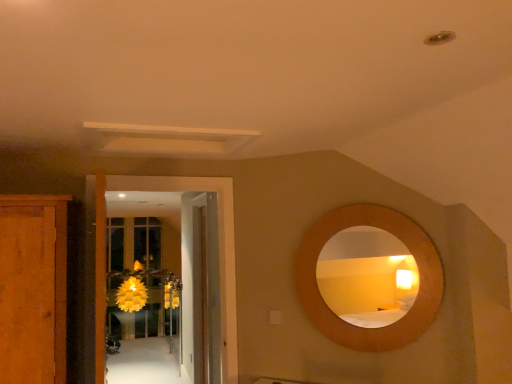
Measure the distance between wooden cabinet at left and camera.

The depth of wooden cabinet at left is 6.20 feet.

Image resolution: width=512 pixels, height=384 pixels. What do you see at coordinates (131, 295) in the screenshot?
I see `yellow paper flower at center` at bounding box center [131, 295].

Where is `translucent yellow glass door at center`? This screenshot has width=512, height=384. translucent yellow glass door at center is located at coordinates (133, 243).

The height and width of the screenshot is (384, 512). I want to click on wooden cabinet at left, so click(x=33, y=288).

Find the location of a particular element. The height and width of the screenshot is (384, 512). the 2nd door behind the wooden cabinet at left, counting from the anchor's position is located at coordinates (200, 287).

Which object is thinner, wooden door at center, arranged as the 2th door when viewed from the front, or wooden cabinet at left?

wooden door at center, arranged as the 2th door when viewed from the front.

From the image's perspective, is wooden door at center, the first door positioned from the back, below wooden cabinet at left?

Correct, wooden door at center, the first door positioned from the back, appears lower than wooden cabinet at left in the image.

From a real-world perspective, which is physically below, wooden cabinet at left or wooden circular mirror at upper right?

wooden cabinet at left.

Would you say wooden cabinet at left is a long distance from wooden circular mirror at upper right?

Yes, wooden cabinet at left is far from wooden circular mirror at upper right.

From the image's perspective, is wooden cabinet at left beneath wooden circular mirror at upper right?

Yes.

Consider the image. Which of these two, wooden cabinet at left or wooden circular mirror at upper right, is wider?

Wider between the two is wooden cabinet at left.

Is point (126, 308) positioned in front of point (222, 216)?

No, (126, 308) is behind (222, 216).

From the image's perspective, relative to white glossy door at center, the second door positioned from the back, is yellow paper flower at center above or below?

From the image's perspective, yellow paper flower at center appears below white glossy door at center, the second door positioned from the back.

Can you confirm if yellow paper flower at center is wider than white glossy door at center, the second door positioned from the back?

Yes, yellow paper flower at center is wider than white glossy door at center, the second door positioned from the back.

Are yellow paper flower at center and white glossy door at center, the second door positioned from the back, far apart?

That's right, there is a large distance between yellow paper flower at center and white glossy door at center, the second door positioned from the back.

From a real-world perspective, does wooden circular mirror at upper right sit lower than wooden door at center, arranged as the 2th door when viewed from the front?

Actually, wooden circular mirror at upper right is physically above wooden door at center, arranged as the 2th door when viewed from the front, in the real world.

Is wooden door at center, arranged as the 2th door when viewed from the front, inside wooden circular mirror at upper right?

No, wooden circular mirror at upper right does not contain wooden door at center, arranged as the 2th door when viewed from the front.

Is wooden circular mirror at upper right smaller than wooden door at center, arranged as the 2th door when viewed from the front?

Yes.

Considering the sizes of objects wooden door at center, the first door positioned from the back, and wooden circular mirror at upper right in the image provided, who is shorter, wooden door at center, the first door positioned from the back, or wooden circular mirror at upper right?

wooden circular mirror at upper right.

Is wooden door at center, the first door positioned from the back, aimed at wooden circular mirror at upper right?

No, wooden door at center, the first door positioned from the back, is not facing towards wooden circular mirror at upper right.

From the image's perspective, is wooden door at center, the first door positioned from the back, located above or below wooden circular mirror at upper right?

Clearly, from the image's perspective, wooden door at center, the first door positioned from the back, is below wooden circular mirror at upper right.

Is point (310, 312) closer or farther from the camera than point (58, 314)?

Point (310, 312).

From the image's perspective, which is below, wooden circular mirror at upper right or wooden cabinet at left?

wooden cabinet at left.

Identify the location of cabinetry in front of the wooden circular mirror at upper right. (33, 288).

Considering the relative sizes of wooden circular mirror at upper right and wooden cabinet at left in the image provided, is wooden circular mirror at upper right bigger than wooden cabinet at left?

Incorrect, wooden circular mirror at upper right is not larger than wooden cabinet at left.

From the picture: From a real-world perspective, is wooden cabinet at left positioned under translucent yellow glass door at center based on gravity?

No.

This screenshot has height=384, width=512. Identify the location of glass door located below the wooden cabinet at left (from the image's perspective). (133, 243).

Which is closer, (64,291) or (145,230)?

Point (64,291) appears to be closer to the viewer than point (145,230).

Find the location of a particular element. This screenshot has width=512, height=384. cabinetry above the wooden door at center, arranged as the 2th door when viewed from the front (from a real-world perspective) is located at coordinates (33, 288).

Find the location of a particular element. This screenshot has width=512, height=384. mirror that appears on the right of wooden cabinet at left is located at coordinates (408, 248).

Looking at the image, which one is located closer to wooden cabinet at left, white glossy door at center, the second door positioned from the back, or wooden door at center, arranged as the 2th door when viewed from the front?

white glossy door at center, the second door positioned from the back, lies closer to wooden cabinet at left than the other object.

From the picture: When comparing their distances from translucent yellow glass door at center, does wooden door at center, the first door positioned from the back, or white glossy door at center, which ranks as the 1th door in front-to-back order, seem further?

white glossy door at center, which ranks as the 1th door in front-to-back order, is positioned further to the anchor translucent yellow glass door at center.

From the image, which object appears to be nearer to wooden door at center, arranged as the 2th door when viewed from the front, translucent yellow glass door at center or yellow paper flower at center?

translucent yellow glass door at center.

Estimate the real-world distances between objects in this image. Which object is closer to translucent yellow glass door at center, wooden door at center, arranged as the 2th door when viewed from the front, or wooden cabinet at left?

Based on the image, wooden door at center, arranged as the 2th door when viewed from the front, appears to be nearer to translucent yellow glass door at center.

From the image, which object appears to be farther from white glossy door at center, which ranks as the 1th door in front-to-back order, wooden circular mirror at upper right or wooden cabinet at left?

wooden cabinet at left lies further to white glossy door at center, which ranks as the 1th door in front-to-back order, than the other object.

Estimate the real-world distances between objects in this image. Which object is closer to white glossy door at center, the second door positioned from the back, wooden door at center, arranged as the 2th door when viewed from the front, or yellow paper flower at center?

Among the two, wooden door at center, arranged as the 2th door when viewed from the front, is located nearer to white glossy door at center, the second door positioned from the back.

From the image, which object appears to be nearer to white glossy door at center, which ranks as the 1th door in front-to-back order, wooden circular mirror at upper right or translucent yellow glass door at center?

wooden circular mirror at upper right is positioned closer to the anchor white glossy door at center, which ranks as the 1th door in front-to-back order.

Estimate the real-world distances between objects in this image. Which object is closer to wooden circular mirror at upper right, white glossy door at center, the second door positioned from the back, or wooden door at center, arranged as the 2th door when viewed from the front?

white glossy door at center, the second door positioned from the back.

This screenshot has width=512, height=384. What are the coordinates of `glass door between wooden circular mirror at upper right and yellow paper flower at center from front to back` in the screenshot? It's located at (133, 243).

Identify the location of door located between wooden cabinet at left and wooden door at center, arranged as the 2th door when viewed from the front, in the depth direction. (219, 250).

Image resolution: width=512 pixels, height=384 pixels. What are the coordinates of `glass door located between white glossy door at center, which ranks as the 1th door in front-to-back order, and yellow paper flower at center in the depth direction` in the screenshot? It's located at (133, 243).

Where is `door positioned between white glossy door at center, which ranks as the 1th door in front-to-back order, and yellow paper flower at center from near to far`? door positioned between white glossy door at center, which ranks as the 1th door in front-to-back order, and yellow paper flower at center from near to far is located at coordinates coord(200,287).